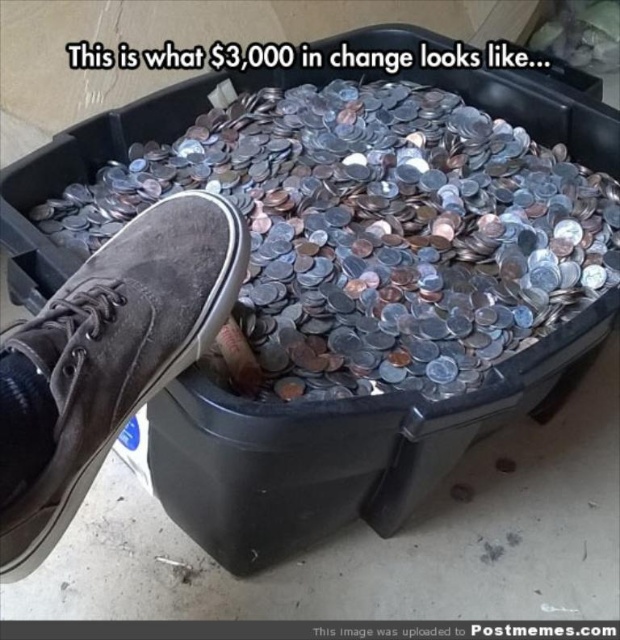
Question: Which point is closer to the camera?

Choices:
 (A) (312, 120)
 (B) (187, 211)

Answer: (B)

Question: Which point is farther to the camera?

Choices:
 (A) silver metallic coins at center
 (B) brown suede shoe at lower left

Answer: (A)

Question: Considering the relative positions of silver metallic coins at center and brown suede shoe at lower left in the image provided, where is silver metallic coins at center located with respect to brown suede shoe at lower left?

Choices:
 (A) below
 (B) above

Answer: (B)

Question: Among these points, which one is nearest to the camera?

Choices:
 (A) (510, 227)
 (B) (112, 317)

Answer: (B)

Question: Is silver metallic coins at center bigger than brown suede shoe at lower left?

Choices:
 (A) yes
 (B) no

Answer: (A)

Question: Does silver metallic coins at center have a lesser width compared to brown suede shoe at lower left?

Choices:
 (A) no
 (B) yes

Answer: (A)